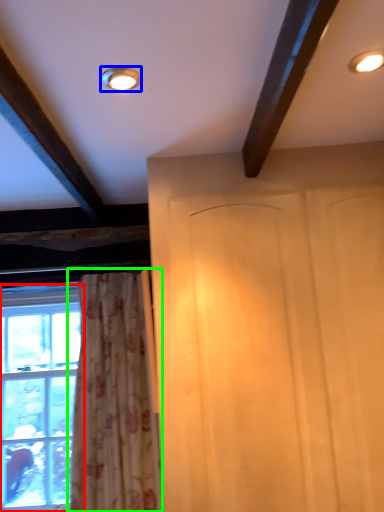
Question: Which object is positioned farthest from window (highlighted by a red box)? Select from lighting (highlighted by a blue box) and curtain (highlighted by a green box).

Choices:
 (A) lighting
 (B) curtain

Answer: (A)